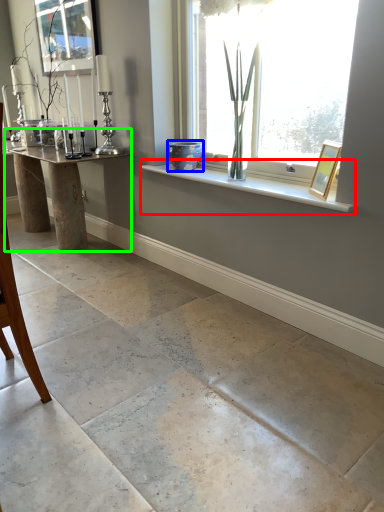
Question: Considering the real-world distances, which object is farthest from window sill (highlighted by a red box)? glass vase (highlighted by a blue box) or table (highlighted by a green box)?

Choices:
 (A) glass vase
 (B) table

Answer: (B)